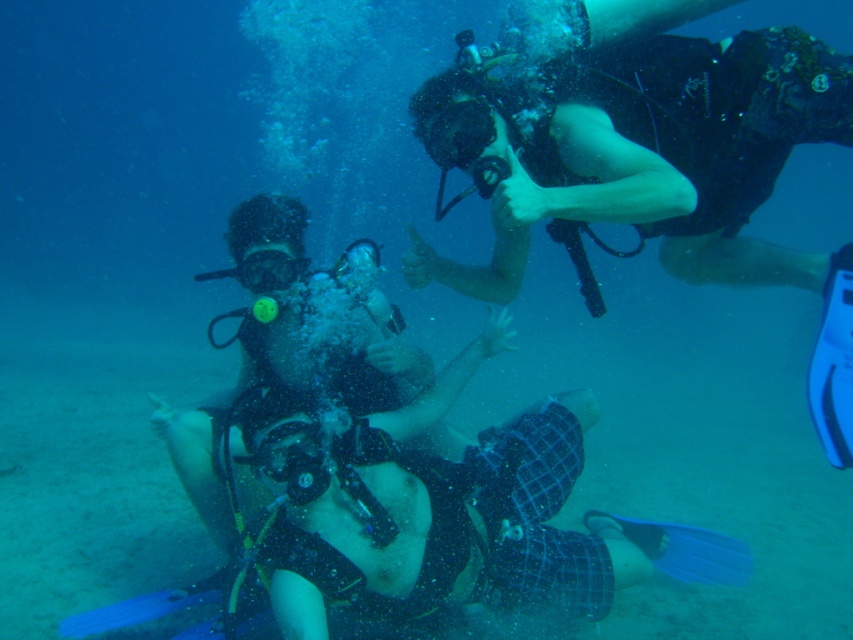
You are a scuba diver planning to adjust your equipment underwater. You have the black matte scuba gear at upper center and the matte black goggles at center. Which equipment should you adjust first if you want to reach the one closer to your current position?

The matte black goggles at center is closer to your current position, so you should adjust it first.

You are a marine biologist planning to place a new underwater sensor at coordinate point 0.25, 0.75. You see the black matte scuba gear at upper center. Will the gear be in the way of the sensor placement?

The black matte scuba gear at upper center is located at point (637, 154), which is very close to your target coordinates of (639, 160). The gear will likely obstruct the sensor placement at that location.

You are a marine biologist observing the underwater scene. You notice the black matte scuba gear at upper center and the matte black goggles at center. Which object is wider?

The black matte scuba gear at upper center is wider than the matte black goggles at center according to the description.